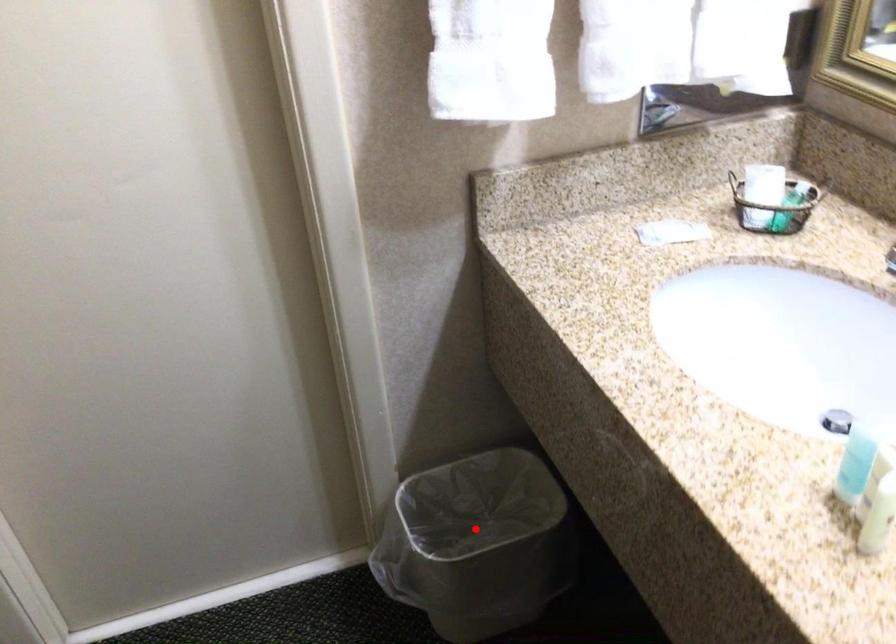
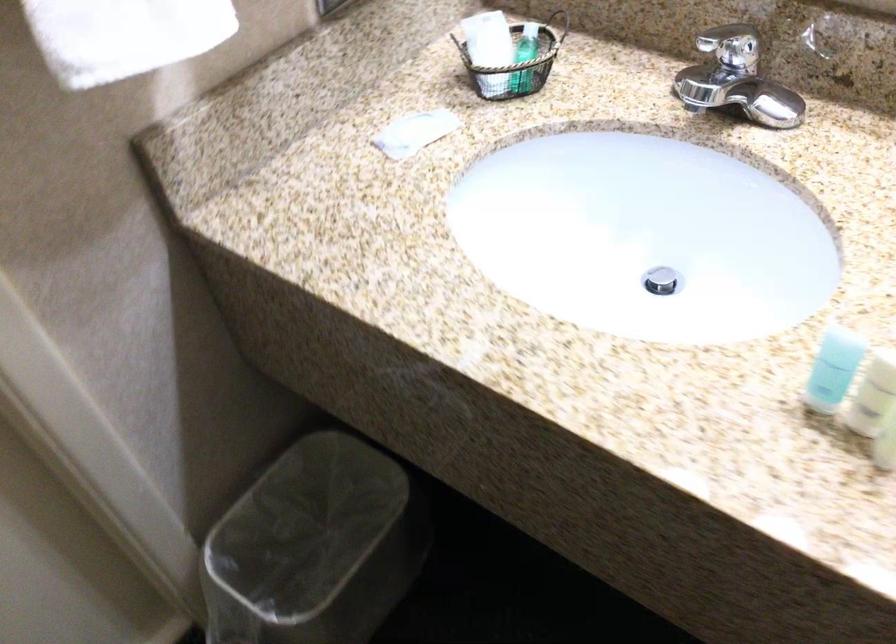
Locate, in the second image, the point that corresponds to the highlighted location in the first image.

(314, 547)